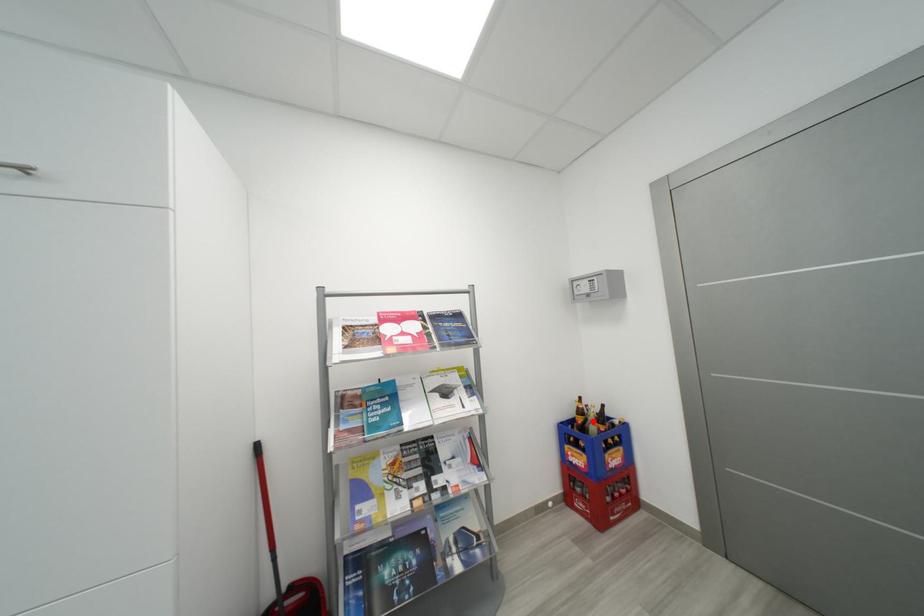
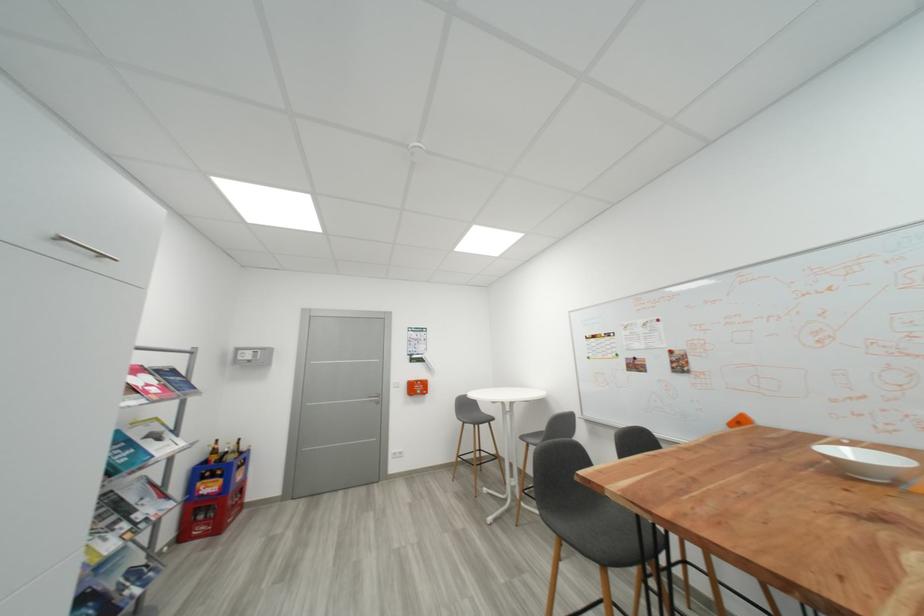
Where in the second image is the point corresponding to the highlighted location from the first image?

(234, 454)